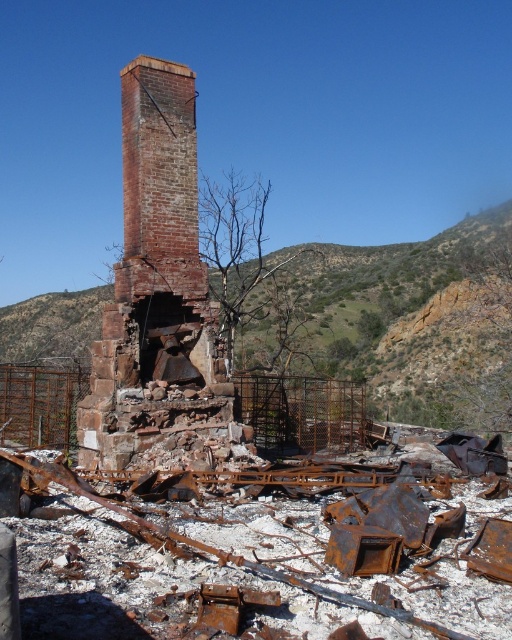
You are a photographer standing at the edge of the destroyed site. You want to take a photo that includes both the rusty metal hillside at center and the rusty brick chimney at center. Which object should you move closer to in order to have both in focus?

You should move closer to the rusty brick chimney at center because the rusty metal hillside at center is further away, so adjusting focus to the closer object will help both be in focus.

You are a surveyor analyzing the coordinates of the rusty metal hillside at center in the image. What are its coordinates?

The coordinates of the rusty metal hillside at center are at point (399, 317).

You are standing at the edge of the destroyed industrial site and want to locate two specific points marked in the image. The first point is at coordinates point [32,353] and the second is at point [123,115]. Which point is closer to you?

Point [32,353] is further to the viewer than point [123,115], so the second point is closer to you.